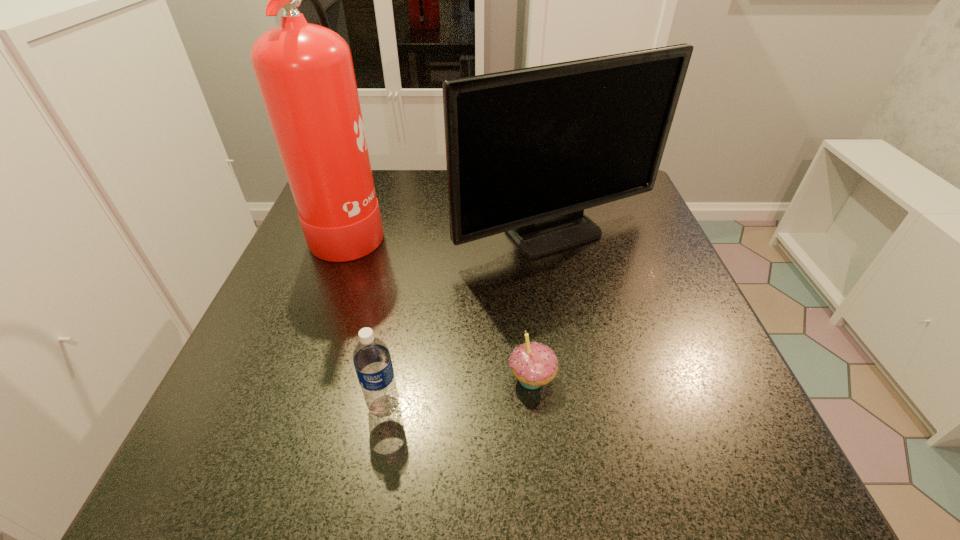
Find the location of a particular element. fire extinguisher located at the far edge is located at coordinates (305, 74).

Find the location of `computer monitor that is at the far edge`. computer monitor that is at the far edge is located at coordinates (527, 150).

Where is `object present at the left edge`? The height and width of the screenshot is (540, 960). object present at the left edge is located at coordinates (305, 74).

Locate an element on the screen. The width and height of the screenshot is (960, 540). object that is at the right edge is located at coordinates (527, 150).

Identify the location of object located in the far left corner section of the desktop. The width and height of the screenshot is (960, 540). (305, 74).

Locate an element on the screen. The width and height of the screenshot is (960, 540). object located at the far right corner is located at coordinates (527, 150).

This screenshot has height=540, width=960. In order to click on free space at the far edge of the desktop in this screenshot , I will do `click(445, 198)`.

The height and width of the screenshot is (540, 960). In the image, there is a desktop. Identify the location of free space at the near edge. (635, 453).

Where is `free location at the right edge`? The image size is (960, 540). free location at the right edge is located at coordinates (676, 292).

In the image, there is a desktop. Where is `vacant space at the near left corner`? This screenshot has width=960, height=540. vacant space at the near left corner is located at coordinates (302, 441).